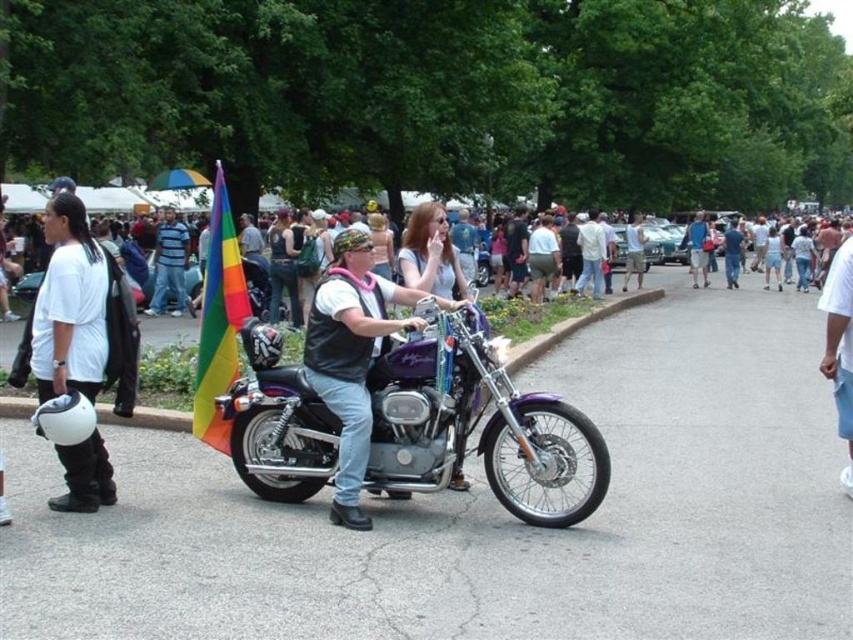
You are a photographer at the festival and want to capture both the purple metallic motorcycle at center and the rainbow fabric flag at left in a single shot. Based on their positions, which object should you focus on first to ensure both are in frame?

The purple metallic motorcycle at center is located below the rainbow fabric flag at left. To capture both in a single shot, focus on the rainbow fabric flag at left first, as it is higher up, allowing the motorcycle to naturally fall into the lower part of the frame.

You are a photographer standing at the center of the scene. You want to take a photo that includes both the rainbow fabric flag at left and the striped cotton shirt at center. What is the minimum distance you need to move backward to ensure both objects are in frame?

The minimum distance you need to move backward is 11.20 meters to ensure both the rainbow fabric flag at left and the striped cotton shirt at center are in frame.

You are a photographer standing at the edge of the scene. You want to capture a photo where the rainbow flag at upper center is visible without being blocked by the striped cotton shirt at center. Should you adjust your position to the left or right to achieve this?

The rainbow flag at upper center is in front of the striped cotton shirt at center, so you don not need to adjust your position. The rainbow flag at upper center is already visible without obstruction.